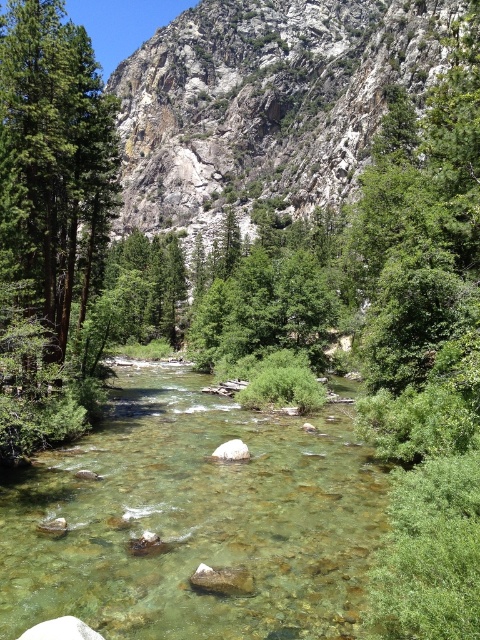
Based on the scene description, what does the point at coordinates point (193, 520) represent?

The point at coordinates point (193, 520) represents the clear glass river at center.

You are standing at the camera position and want to cross the clear glass river at center to reach the other side. The river is 24.99 meters away from you. If you can walk at a speed of 1.5 meters per second, how many seconds will it take you to reach the other side?

The clear glass river at center is 24.99 meters away from the camera. To cross it at a speed of 1.5 meters per second, it would take approximately 16.66 seconds. However, since you can only provide whole numbers, the answer is 17 seconds.

You are a hiker who wants to cross the clear glass river at center to reach the other side. There is a green matte tree at left nearby. Which direction should you walk from the tree to get to the river?

You should walk to the right from the green matte tree at left to reach the clear glass river at center since the river is positioned to the right of the tree.